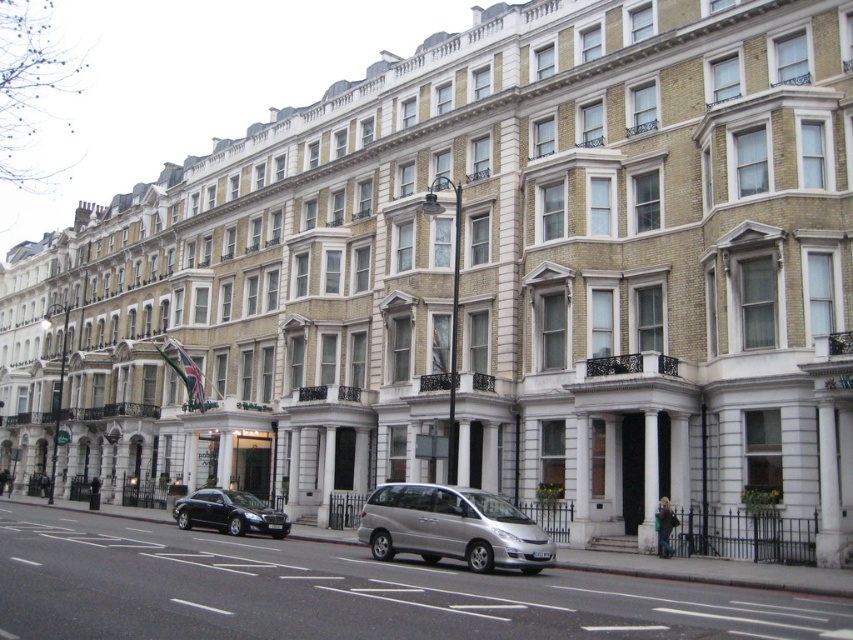
Which is in front, point (364, 540) or point (267, 532)?

Point (364, 540) is in front.

Which is above, silver metallic minivan at center or shiny black sedan at lower left?

silver metallic minivan at center is higher up.

This screenshot has width=853, height=640. What are the coordinates of `silver metallic minivan at center` in the screenshot? It's located at (451, 528).

Who is shorter, silver metallic van at center or shiny black sedan at lower left?

silver metallic van at center is shorter.

What do you see at coordinates (341, 593) in the screenshot? I see `silver metallic van at center` at bounding box center [341, 593].

Who is more forward, (520, 600) or (209, 496)?

Point (520, 600) is more forward.

The width and height of the screenshot is (853, 640). What are the coordinates of `silver metallic van at center` in the screenshot? It's located at pyautogui.click(x=341, y=593).

Is point (345, 602) behind point (466, 524)?

No, (345, 602) is in front of (466, 524).

Between point (91, 556) and point (358, 512), which one is positioned behind?

Positioned behind is point (358, 512).

Identify the location of silver metallic van at center. This screenshot has height=640, width=853. (341, 593).